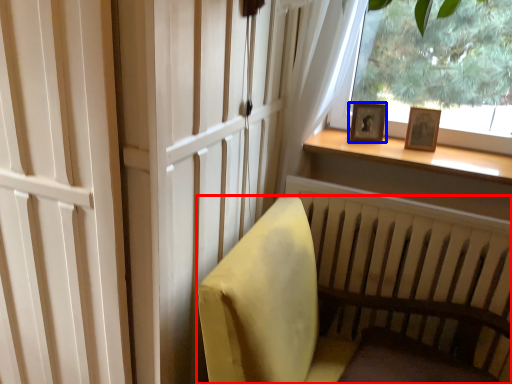
Question: Which object is closer to the camera taking this photo, furniture (highlighted by a red box) or picture frame (highlighted by a blue box)?

Choices:
 (A) furniture
 (B) picture frame

Answer: (A)